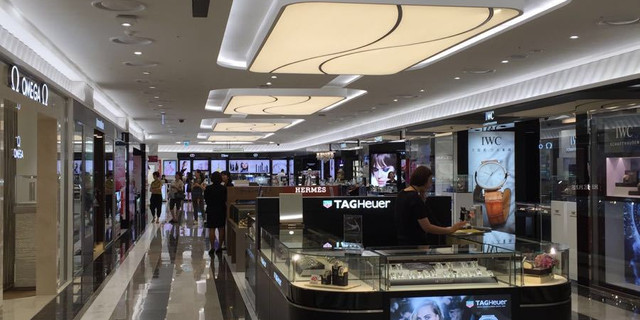
This screenshot has width=640, height=320. What are the coordinates of `overhead light` in the screenshot? It's located at (339, 50), (288, 99).